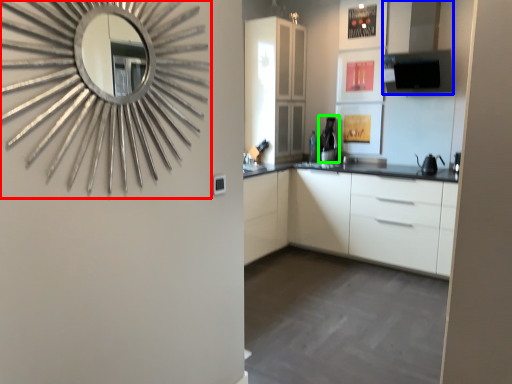
Question: Estimate the real-world distances between objects in this image. Which object is farther from mirror (highlighted by a red box), exhaust hood (highlighted by a blue box) or coffee machine (highlighted by a green box)?

Choices:
 (A) exhaust hood
 (B) coffee machine

Answer: (B)